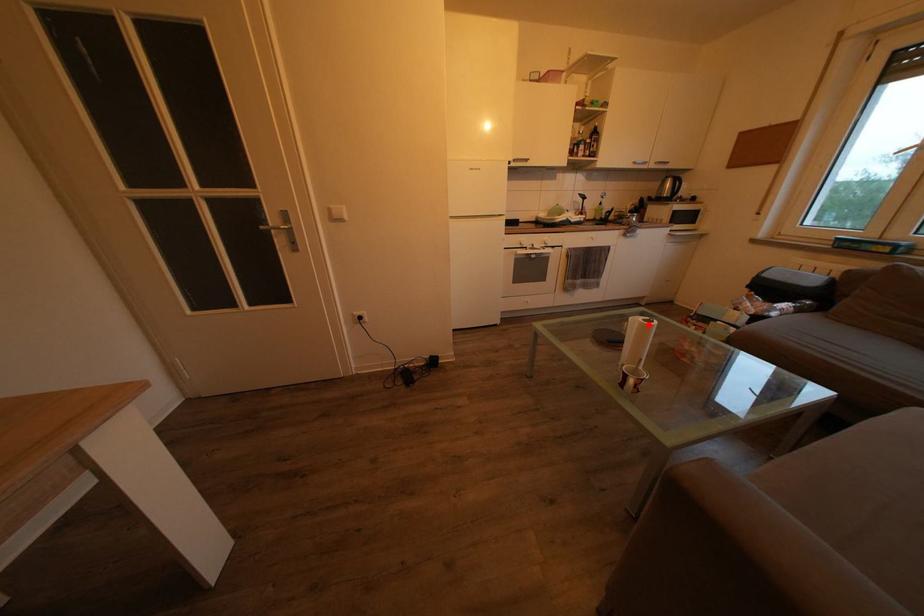
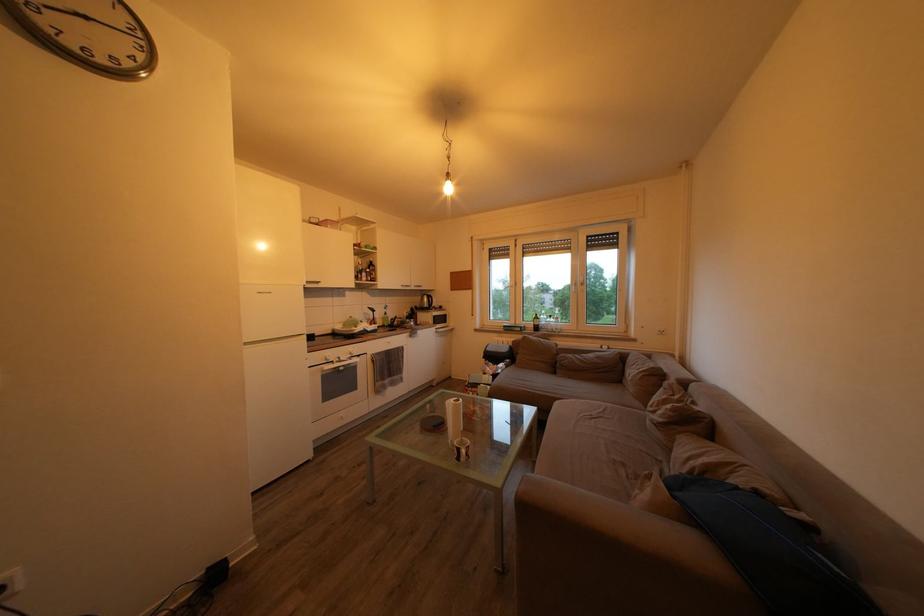
Question: I am providing you with two images of the same scene from different viewpoints. In image1, a red point is highlighted. Considering the same 3D point in image2, which of the following is correct?

Choices:
 (A) It is closer
 (B) It is farther

Answer: (A)